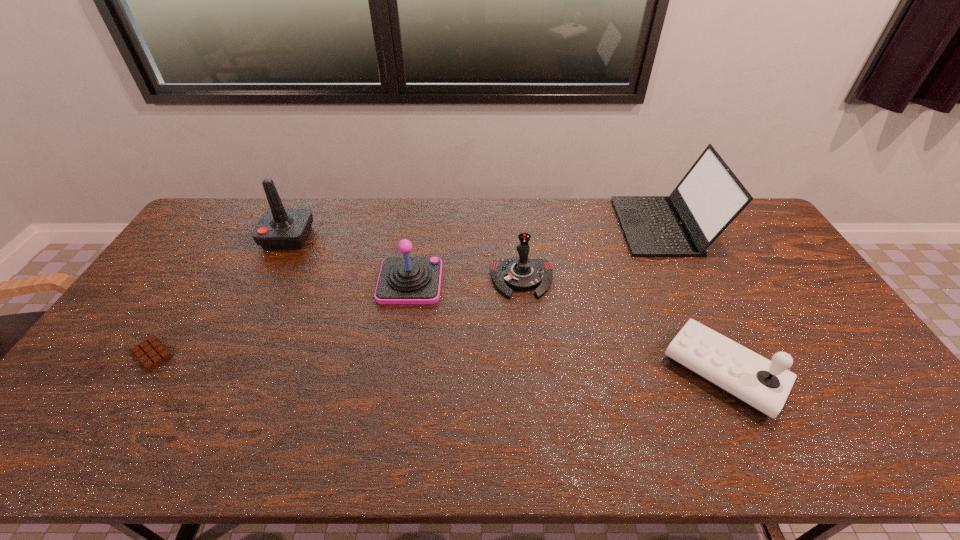
The width and height of the screenshot is (960, 540). Identify the location of vacant position in the image that satisfies the following two spatial constraints: 1. on the handle side of the nearest joystick; 2. on the left side of the fourth object from left to right. (531, 372).